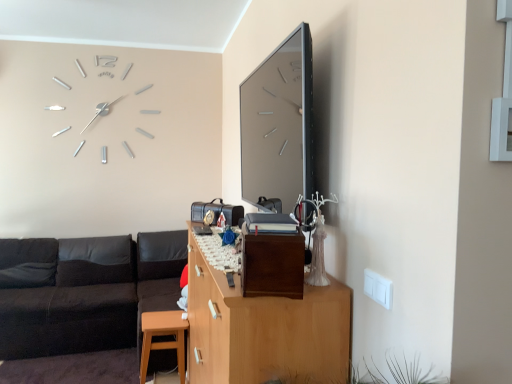
Question: Considering the relative sizes of black leather couch at lower left and matte wood stool at lower left in the image provided, is black leather couch at lower left bigger than matte wood stool at lower left?

Choices:
 (A) yes
 (B) no

Answer: (A)

Question: From the image's perspective, is black leather couch at lower left located beneath matte wood stool at lower left?

Choices:
 (A) no
 (B) yes

Answer: (A)

Question: Does black leather couch at lower left have a smaller size compared to matte wood stool at lower left?

Choices:
 (A) yes
 (B) no

Answer: (B)

Question: Can you confirm if black leather couch at lower left is positioned to the left of matte wood stool at lower left?

Choices:
 (A) yes
 (B) no

Answer: (A)

Question: Is matte wood stool at lower left located within black leather couch at lower left?

Choices:
 (A) no
 (B) yes

Answer: (A)

Question: Considering the positions of black leather couch at left and black leather couch at lower left in the image, is black leather couch at left bigger or smaller than black leather couch at lower left?

Choices:
 (A) big
 (B) small

Answer: (A)

Question: Considering the positions of point (131, 269) and point (163, 357), is point (131, 269) closer or farther from the camera than point (163, 357)?

Choices:
 (A) closer
 (B) farther

Answer: (B)

Question: From the image's perspective, is black leather couch at left located above or below black leather couch at lower left?

Choices:
 (A) below
 (B) above

Answer: (A)

Question: Is black leather couch at left wider or thinner than black leather couch at lower left?

Choices:
 (A) thin
 (B) wide

Answer: (B)

Question: Relative to black leather couch at left, is brown matte/file cabinet at center in front or behind?

Choices:
 (A) behind
 (B) front

Answer: (B)

Question: Is brown matte/file cabinet at center to the left or to the right of black leather couch at left in the image?

Choices:
 (A) left
 (B) right

Answer: (B)

Question: Is brown matte/file cabinet at center inside or outside of black leather couch at left?

Choices:
 (A) inside
 (B) outside

Answer: (B)

Question: Considering the positions of brown matte/file cabinet at center and black leather couch at left in the image, is brown matte/file cabinet at center taller or shorter than black leather couch at left?

Choices:
 (A) tall
 (B) short

Answer: (B)

Question: Considering the relative positions of wooden cabinet at center and black leather couch at lower left in the image provided, is wooden cabinet at center to the left or to the right of black leather couch at lower left?

Choices:
 (A) right
 (B) left

Answer: (A)

Question: From the image's perspective, is wooden cabinet at center located above or below black leather couch at lower left?

Choices:
 (A) above
 (B) below

Answer: (B)